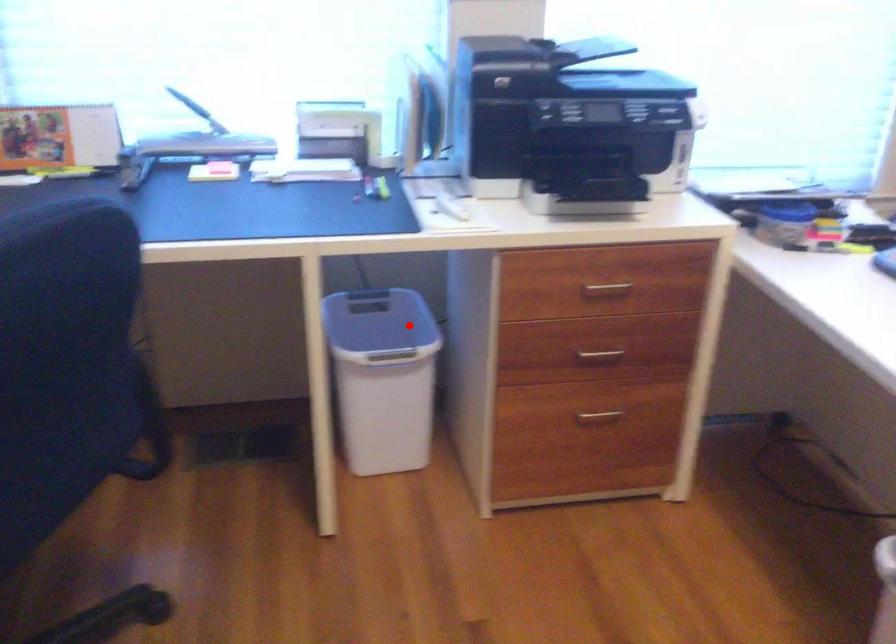
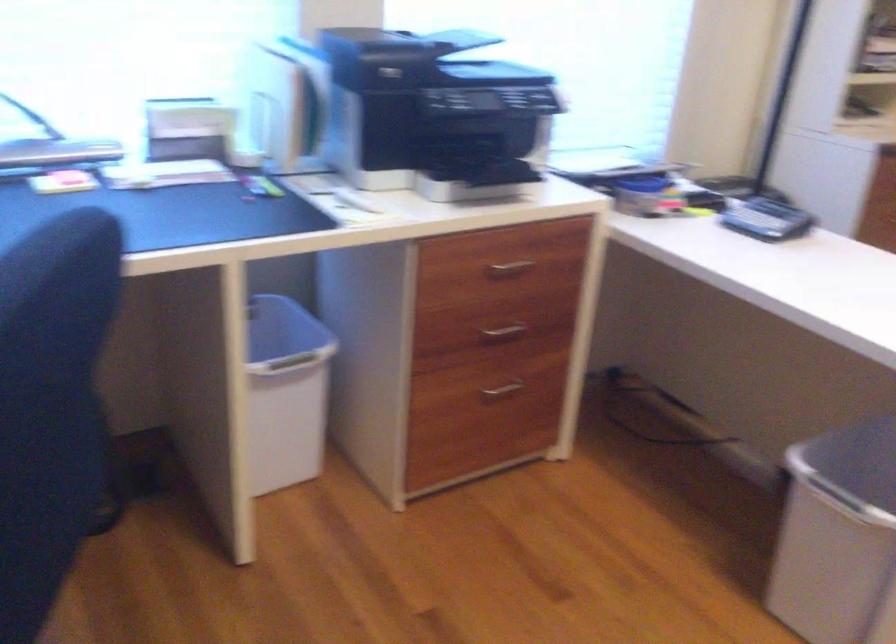
Where in the second image is the point corresponding to the highlighted location from the first image?

(281, 328)